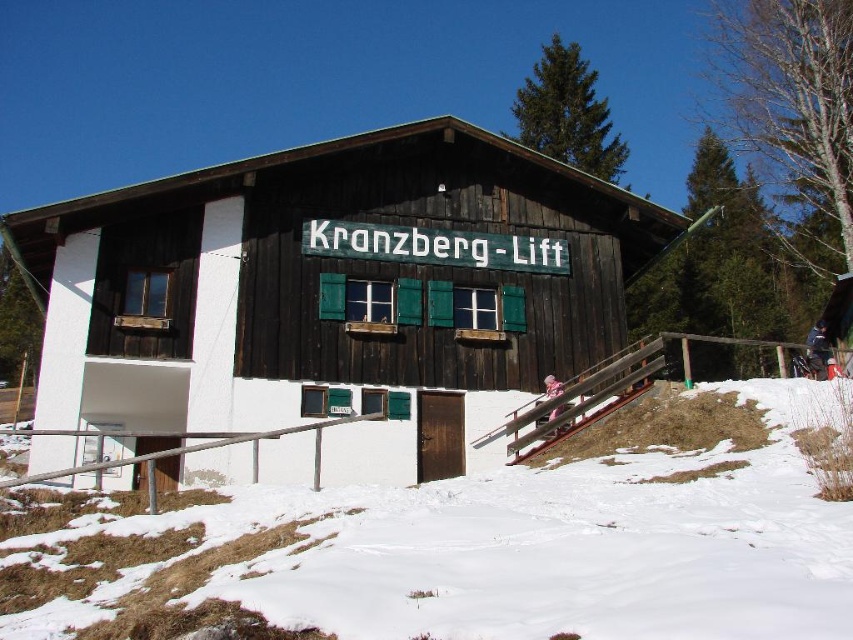
Question: Based on their relative distances, which object is farther from the white powdery snow at lower center?

Choices:
 (A) pink fabric at center
 (B) wooden cabin at center

Answer: (A)

Question: Is wooden cabin at center to the left of white powdery snow at lower center from the viewer's perspective?

Choices:
 (A) yes
 (B) no

Answer: (A)

Question: Which of the following is the closest to the observer?

Choices:
 (A) (560, 429)
 (B) (585, 579)

Answer: (B)

Question: Is white powdery snow at lower center to the left of pink fabric at center from the viewer's perspective?

Choices:
 (A) yes
 (B) no

Answer: (A)

Question: Does wooden cabin at center come in front of white powdery snow at lower center?

Choices:
 (A) yes
 (B) no

Answer: (B)

Question: Among these points, which one is farthest from the camera?

Choices:
 (A) (305, 310)
 (B) (270, 605)

Answer: (A)